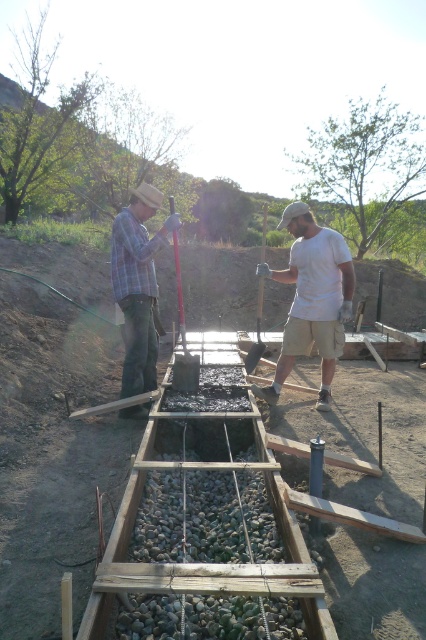
Question: Is white matte shirt at center wider than plaid fabric shirt at left?

Choices:
 (A) yes
 (B) no

Answer: (A)

Question: Can you confirm if plaid fabric shirt at left is smaller than metallic silver shovel at center?

Choices:
 (A) no
 (B) yes

Answer: (B)

Question: Does plaid fabric shirt at left appear over metallic silver shovel at center?

Choices:
 (A) no
 (B) yes

Answer: (A)

Question: Among these points, which one is nearest to the camera?

Choices:
 (A) (195, 365)
 (B) (138, 230)
 (C) (265, 211)
 (D) (287, 208)

Answer: (B)

Question: Which object is the closest to the plaid fabric shirt at left?

Choices:
 (A) white matte shirt at center
 (B) matte black concrete at center

Answer: (A)

Question: Which of these objects is positioned closest to the white matte shirt at center?

Choices:
 (A) metallic silver shovel at center
 (B) metallic shovel at center
 (C) plaid fabric shirt at left
 (D) matte black concrete at center

Answer: (D)